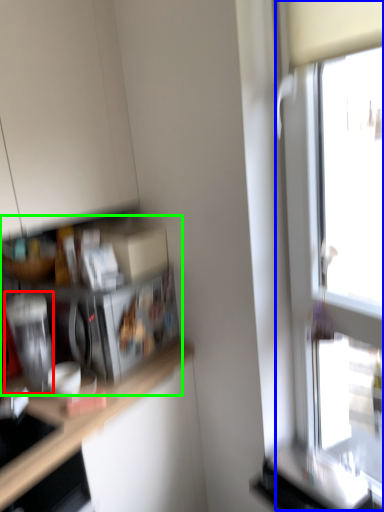
Question: Estimate the real-world distances between objects in this image. Which object is closer to appliance (highlighted by a red box), window (highlighted by a blue box) or shelf (highlighted by a green box)?

Choices:
 (A) window
 (B) shelf

Answer: (B)